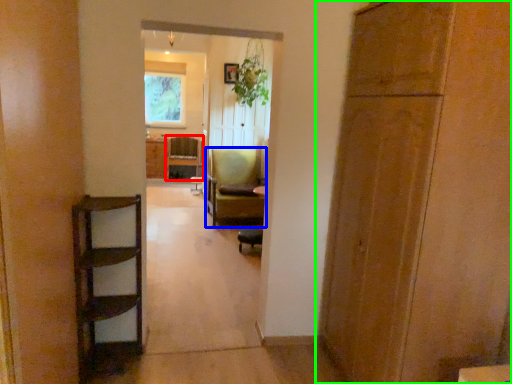
Question: Which object is positioned farthest from chair (highlighted by a red box)? Select from chair (highlighted by a blue box) and door (highlighted by a green box).

Choices:
 (A) chair
 (B) door

Answer: (B)